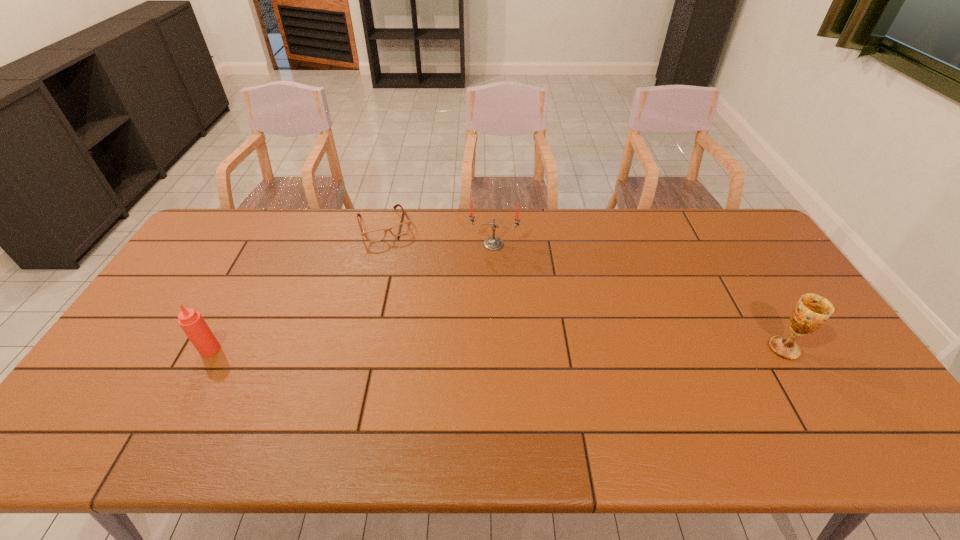
At what (x,y) coordinates should I click in order to perform the action: click on vacant space on the desktop that is between the Tabasco sauce and the chalice and is positioned on the front-facing side of the candle. Please return your answer as a coordinate pair (x, y). This screenshot has width=960, height=540. Looking at the image, I should click on (478, 349).

In order to click on free spot on the desktop that is between the Tabasco sauce and the chalice and is positioned on the front-facing side of the third object from right to left in this screenshot , I will do `click(443, 349)`.